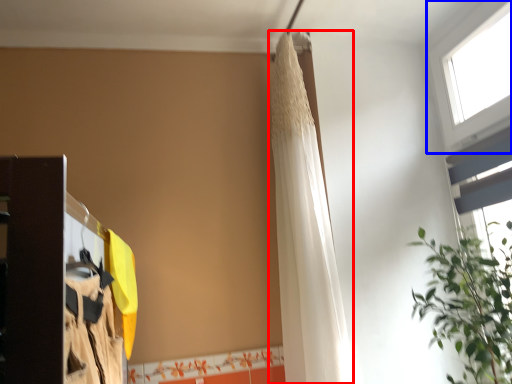
Question: Among these objects, which one is farthest to the camera, shower curtain (highlighted by a red box) or window (highlighted by a blue box)?

Choices:
 (A) shower curtain
 (B) window

Answer: (A)